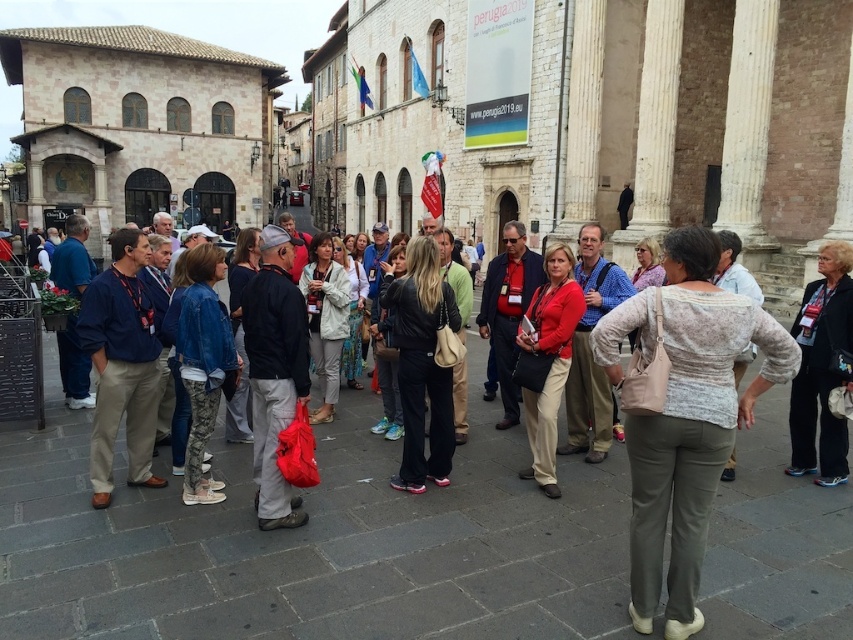
Is light gray fabric jacket at center further to camera compared to light blue denim jacket at center?

No, it is in front of light blue denim jacket at center.

Which is more to the right, light gray fabric jacket at center or light blue denim jacket at center?

light blue denim jacket at center is more to the right.

In order to click on light gray fabric jacket at center in this screenshot , I will do `click(325, 317)`.

Can you confirm if black leather jacket at center is positioned above matte red shirt at center?

Yes.

Which is in front, point (428, 440) or point (560, 250)?

Point (428, 440) is more forward.

Does point (434, 448) come behind point (544, 269)?

That is False.

Identify the location of black leather jacket at center. (421, 364).

Is point (251, 368) positioned behind point (366, 291)?

No, it is in front of (366, 291).

Is matte black jacket at center smaller than light blue denim jacket at center?

Incorrect, matte black jacket at center is not smaller in size than light blue denim jacket at center.

Does point (287, 417) come farther from viewer compared to point (352, 372)?

That is False.

Find the location of a particular element. matte black jacket at center is located at coordinates (274, 371).